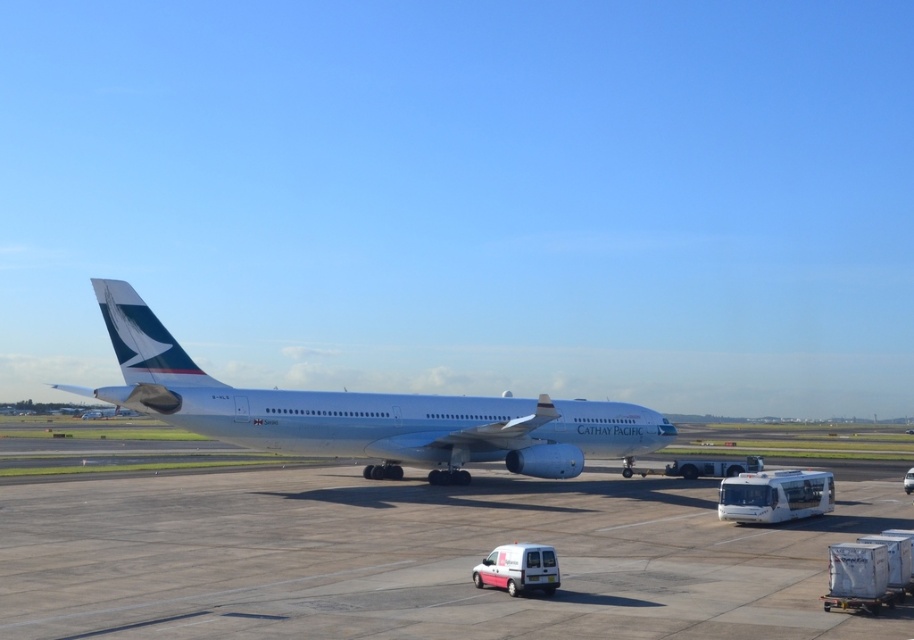
You are a pilot preparing to taxi the silver metallic airplane at center. You need to ensure there is enough space on the smooth concrete tarmac at center for the airplane to maneuver. Based on the scene, can you determine if the tarmac is large enough?

The smooth concrete tarmac at center has a smaller size compared to silver metallic airplane at center, so it may not be large enough for the airplane to maneuver safely. Consider checking for alternative larger tarmacs or adjusting the aircraft size.

You are a pilot preparing to board the silver metallic airplane at center. You need to walk from the smooth concrete tarmac at center to the airplane. Which direction should you walk to reach the airplane?

The smooth concrete tarmac at center is in front of the silver metallic airplane at center, so you should walk backward to reach the airplane.